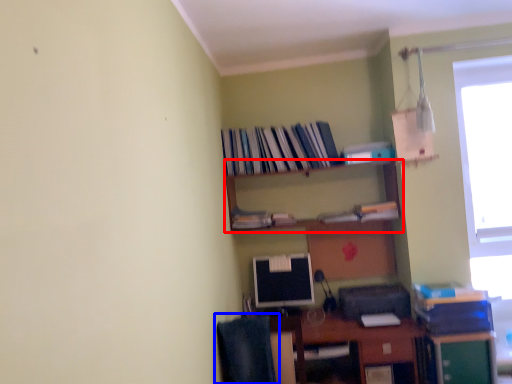
Question: Which object is further to the camera taking this photo, shelf (highlighted by a red box) or computer chair (highlighted by a blue box)?

Choices:
 (A) shelf
 (B) computer chair

Answer: (A)